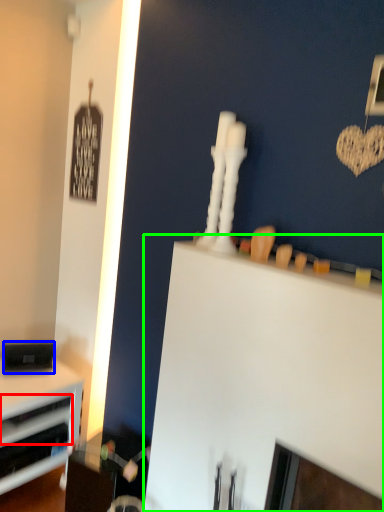
Question: Based on their relative distances, which object is farther from drawer (highlighted by a red box)? Choose from appliance (highlighted by a blue box) and computer desk (highlighted by a green box).

Choices:
 (A) appliance
 (B) computer desk

Answer: (B)